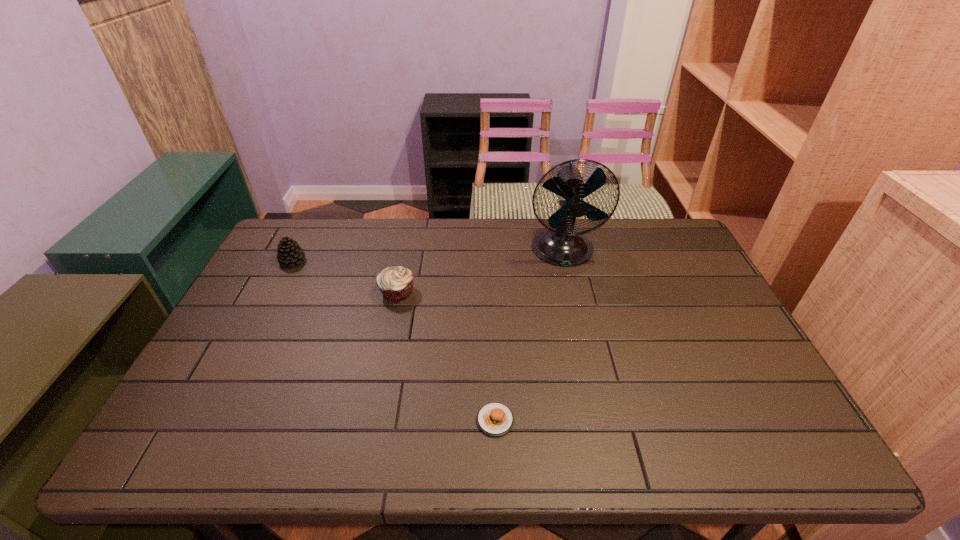
You are a GUI agent. You are given a task and a screenshot of the screen. Output one action in this format:
    pyautogui.click(x=<x>, y=<y>)
    Task: Click on the free spot that satisfies the following two spatial constraints: 1. at the narrow end of the pinecone; 2. on the left side of the third farthest object
    Image resolution: width=960 pixels, height=540 pixels.
    Given the screenshot: What is the action you would take?
    click(277, 292)

Image resolution: width=960 pixels, height=540 pixels. I want to click on vacant area that satisfies the following two spatial constraints: 1. at the narrow end of the leftmost object; 2. on the left side of the third object from right to left, so click(x=277, y=292).

The width and height of the screenshot is (960, 540). Identify the location of vacant space that satisfies the following two spatial constraints: 1. at the narrow end of the second nearest object; 2. on the right side of the leftmost object. (277, 292).

This screenshot has height=540, width=960. I want to click on vacant space that satisfies the following two spatial constraints: 1. on the front-facing side of the rightmost object; 2. at the narrow end of the leftmost object, so click(x=565, y=261).